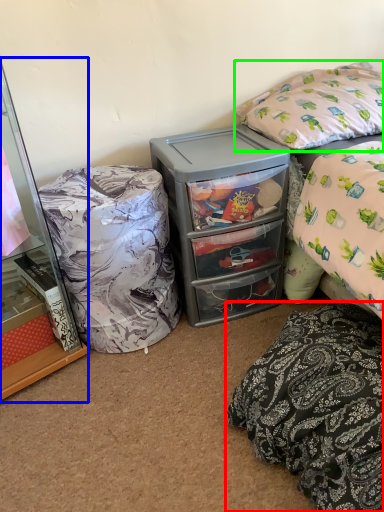
Question: Estimate the real-world distances between objects in this image. Which object is farther from pillow (highlighted by a red box), cabinetry (highlighted by a blue box) or pillow (highlighted by a green box)?

Choices:
 (A) cabinetry
 (B) pillow

Answer: (A)